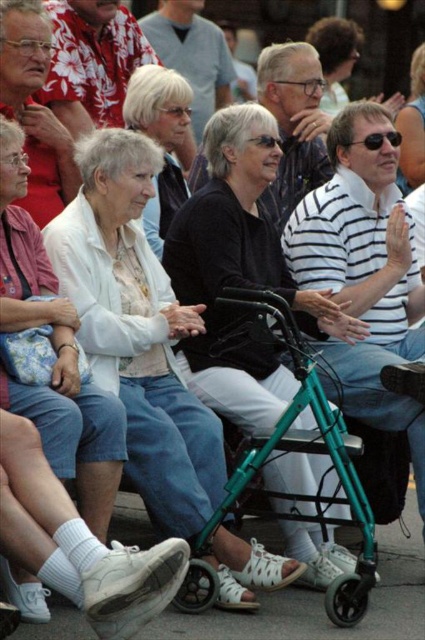
Question: Among these objects, which one is nearest to the camera?

Choices:
 (A) black fabric walker at center
 (B) white matte walker at center

Answer: (B)

Question: Which object is closer to the camera taking this photo?

Choices:
 (A) white matte shirt at center
 (B) white matte walker at center
 (C) black fabric walker at center

Answer: (A)

Question: Which is farther from the white matte shirt at center?

Choices:
 (A) white textured sweater at center
 (B) matte black sunglasses at upper center
 (C) white matte walker at center

Answer: (B)

Question: Considering the relative positions of white matte walker at center and white textured sweater at center in the image provided, where is white matte walker at center located with respect to white textured sweater at center?

Choices:
 (A) below
 (B) above

Answer: (A)

Question: Does black fabric walker at center have a smaller size compared to matte black sunglasses at upper center?

Choices:
 (A) no
 (B) yes

Answer: (B)

Question: Does white matte walker at center appear under white matte shirt at center?

Choices:
 (A) yes
 (B) no

Answer: (A)